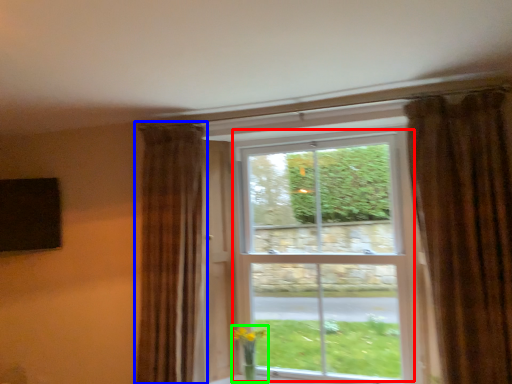
Question: Estimate the real-world distances between objects in this image. Which object is closer to bay window (highlighted by a red box), curtain (highlighted by a blue box) or floral arrangement (highlighted by a green box)?

Choices:
 (A) curtain
 (B) floral arrangement

Answer: (A)